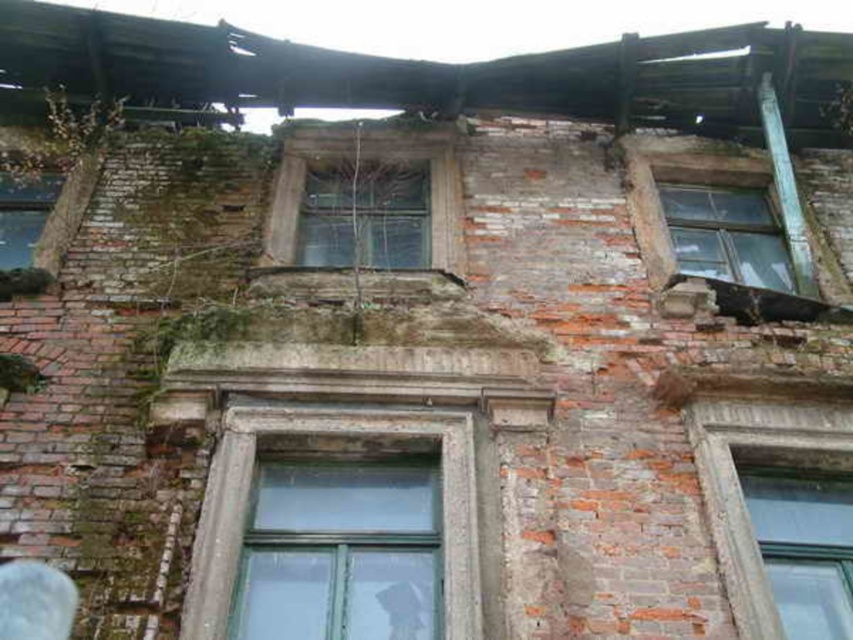
Question: Which object is farther from the camera taking this photo?

Choices:
 (A) clear glass window at center
 (B) transparent glass window at upper right
 (C) transparent glass window at upper left

Answer: (B)

Question: Which of the following is the closest to the observer?

Choices:
 (A) transparent glass window at center
 (B) transparent glass window at upper right
 (C) transparent glass window at upper left

Answer: (C)

Question: Does clear glass window at lower right have a greater width compared to transparent glass window at upper right?

Choices:
 (A) yes
 (B) no

Answer: (B)

Question: Does clear glass window at center appear on the left side of transparent glass window at center?

Choices:
 (A) yes
 (B) no

Answer: (B)

Question: Observing the image, what is the correct spatial positioning of clear glass window at lower right in reference to transparent glass window at upper right?

Choices:
 (A) right
 (B) left

Answer: (B)

Question: Among these objects, which one is nearest to the camera?

Choices:
 (A) clear glass window at lower right
 (B) transparent glass window at upper right

Answer: (A)